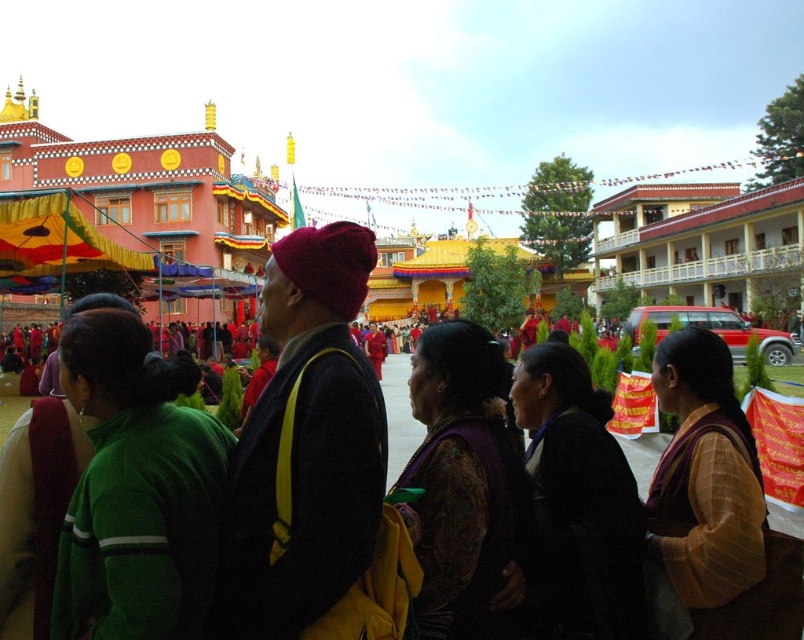
You are standing in the vibrant outdoor scene described. You see two points marked in the image. The first point is at coordinates point [224,598] and the second is at point [618,467]. Which point is closer to your current position?

Point [224,598] is closer to the camera than point [618,467], so the first point is closer to your current position.

You are standing at the origin point in the image and want to know which of the two points, point (595, 515) or point (716, 518), is closer to you. Based on the scene description, can you determine which point is nearer?

Point (716, 518) is closer to you because it is in front of point (595, 515).

You are a photographer at the event and want to ensure both the dark red woolen hat at center and the black velvet dress at center are visible in your photo. Considering their heights, which object should you focus on to ensure both are in frame?

The dark red woolen hat at center is much taller than the black velvet dress at center. To ensure both are visible in the photo, focus on capturing the height of the dark red woolen hat at center, as it is taller, ensuring the black velvet dress at center will naturally be in frame below it.